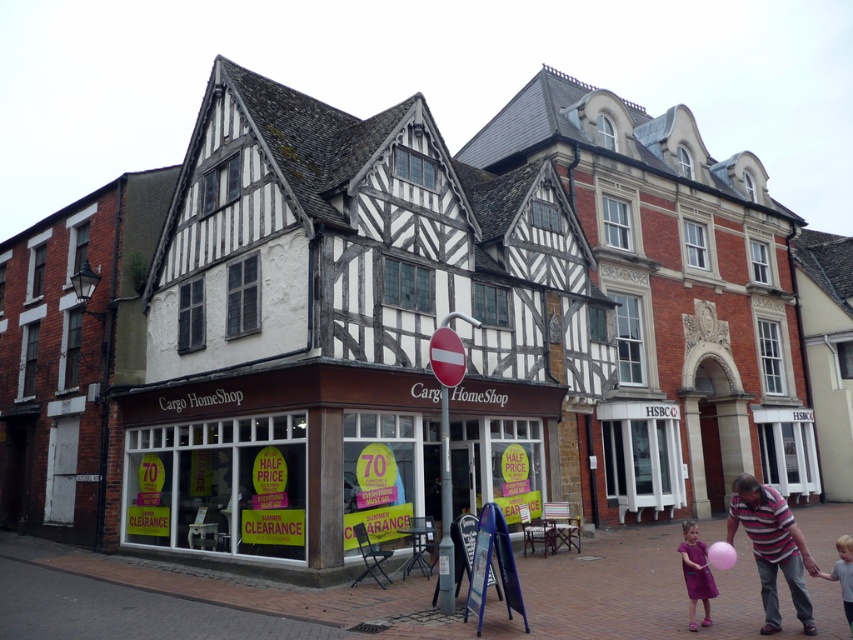
Question: Which point appears farthest from the camera in this image?

Choices:
 (A) (294, 554)
 (B) (440, 442)
 (C) (688, 612)

Answer: (A)

Question: Can you confirm if matte brown storefront at center is smaller than pink rubber balloon at lower right?

Choices:
 (A) yes
 (B) no

Answer: (B)

Question: Considering the real-world distances, which object is farthest from the red plastic sign at center?

Choices:
 (A) light blue fabric shirt at lower right
 (B) purple satin dress at lower right

Answer: (A)

Question: Which of these objects is positioned farthest from the matte brown storefront at center?

Choices:
 (A) purple satin dress at lower right
 (B) red plastic sign at center

Answer: (A)

Question: Can you confirm if matte brown storefront at center is smaller than purple satin dress at lower right?

Choices:
 (A) yes
 (B) no

Answer: (B)

Question: Can you confirm if light blue fabric shirt at lower right is positioned to the left of pink rubber balloon at lower right?

Choices:
 (A) no
 (B) yes

Answer: (A)